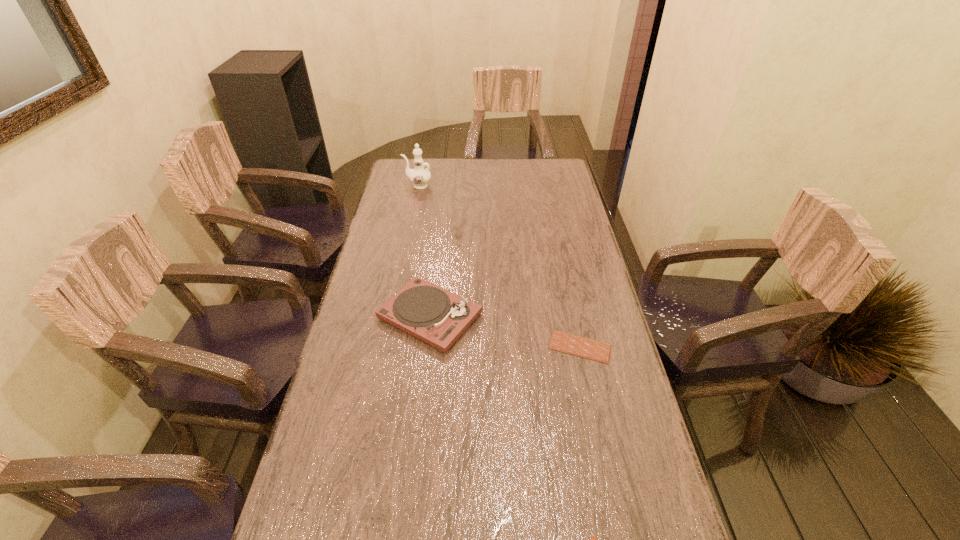
Identify the location of free space between the taller chocolate bar and the chinaware. (499, 266).

At what (x,y) coordinates should I click in order to perform the action: click on free space between the farther chocolate bar and the chinaware. Please return your answer as a coordinate pair (x, y). The width and height of the screenshot is (960, 540). Looking at the image, I should click on [499, 266].

The width and height of the screenshot is (960, 540). Identify the location of vacant point located between the farther chocolate bar and the tallest object. (499, 266).

Where is `object that is the nearest to the second tallest object`? object that is the nearest to the second tallest object is located at coordinates (567, 343).

Choose which object is the third nearest neighbor to the third tallest object. Please provide its 2D coordinates. Your answer should be formatted as a tuple, i.e. [(x, y)], where the tuple contains the x and y coordinates of a point satisfying the conditions above.

[(419, 176)]

The width and height of the screenshot is (960, 540). I want to click on free space in the image that satisfies the following two spatial constraints: 1. on the back side of the taller chocolate bar; 2. at the spout of the tallest object, so click(545, 186).

Image resolution: width=960 pixels, height=540 pixels. I want to click on free space that satisfies the following two spatial constraints: 1. at the spout of the second tallest object; 2. on the left side of the chinaware, so click(392, 316).

At what (x,y) coordinates should I click in order to perform the action: click on free space in the image that satisfies the following two spatial constraints: 1. at the spout of the tallest object; 2. on the left side of the third shortest object. Please return your answer as a coordinate pair (x, y). This screenshot has height=540, width=960. Looking at the image, I should click on (392, 316).

Identify the location of vacant region that satisfies the following two spatial constraints: 1. at the spout of the farther chocolate bar; 2. on the left side of the farthest object. This screenshot has width=960, height=540. (385, 347).